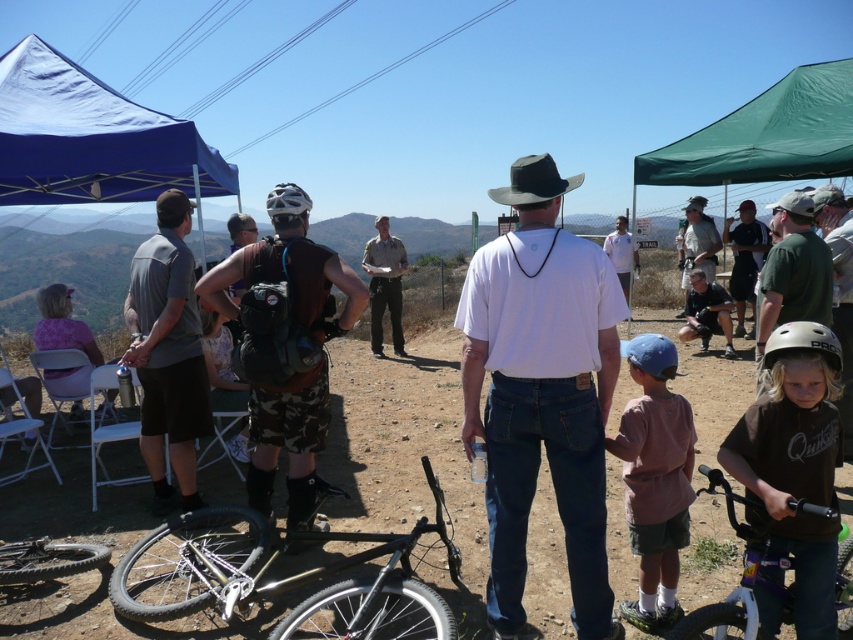
You are organizing a photo shoot and need to ensure that the camo shorts at center and the blue matte helmet at center are both visible in the frame. Given their sizes, which object should you prioritize positioning closer to the camera to maintain clarity?

The camo shorts at center should be positioned closer to the camera since its width surpasses that of the blue matte helmet at center, ensuring both remain visible and clear in the photo.

You are at the point marked by the coordinates point (91, 138). Which object is directly above you?

The point (91, 138) is on the blue fabric canopy at upper left, so the blue fabric canopy at upper left is directly above you.

You are organizing a photo shoot and need to place two items in the scene. The items are the light brown leather jacket at center and the white matte shirt at center. The photographer wants to ensure that the jacket and shirt do not overlap in the final image. Given their sizes, which item should be placed farther back to avoid overlapping?

The light brown leather jacket at center is wider than the white matte shirt at center. To prevent overlapping, the wider jacket should be placed farther back so that its larger size doesn